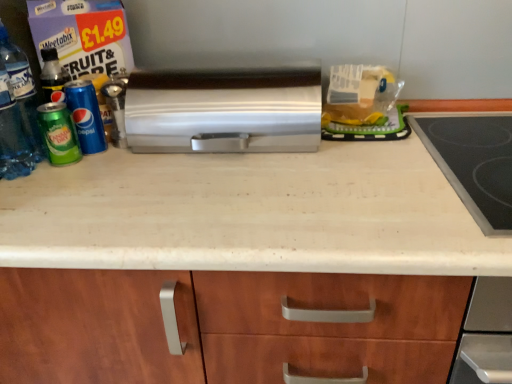
Locate an element on the screen. The image size is (512, 384). free space in front of translucent plastic bottle at left is located at coordinates (33, 211).